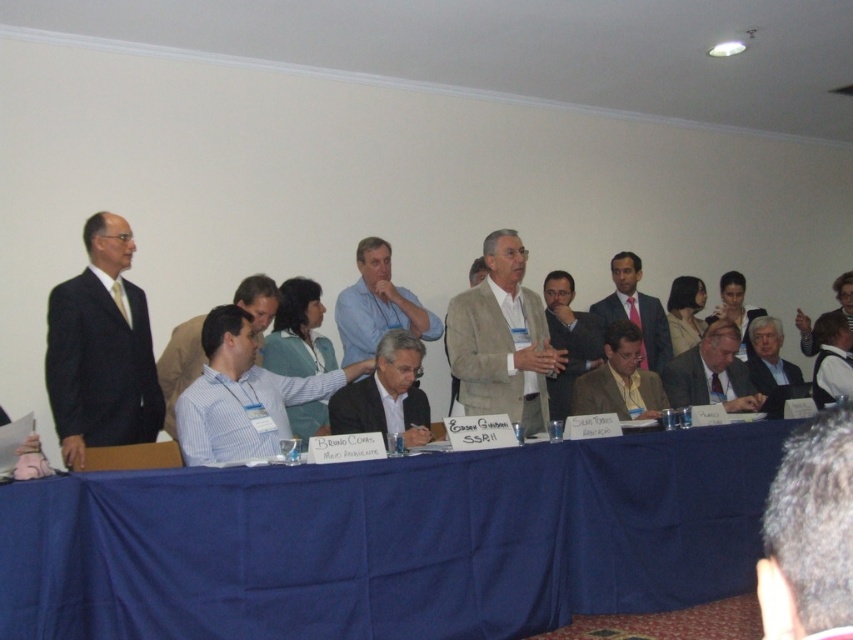
Which is below, light blue striped shirt at center or matte gray suit at center?

light blue striped shirt at center

Can you confirm if light blue striped shirt at center is bigger than matte gray suit at center?

Yes.

Who is more forward, (235, 401) or (573, 374)?

Point (235, 401)

You are a GUI agent. You are given a task and a screenshot of the screen. Output one action in this format:
    pyautogui.click(x=<x>, y=<y>)
    Task: Click on the light blue striped shirt at center
    The height and width of the screenshot is (640, 853).
    Given the screenshot: What is the action you would take?
    pyautogui.click(x=242, y=396)

Describe the element at coordinates (386, 394) in the screenshot. I see `matte white shirt at center` at that location.

Locate an element on the screen. matte white shirt at center is located at coordinates (386, 394).

Is light brown suit at center below light blue shirt at center?

Indeed, light brown suit at center is positioned under light blue shirt at center.

Who is positioned more to the right, light brown suit at center or light blue shirt at center?

light brown suit at center is more to the right.

Where is `light brown suit at center`? light brown suit at center is located at coordinates (712, 372).